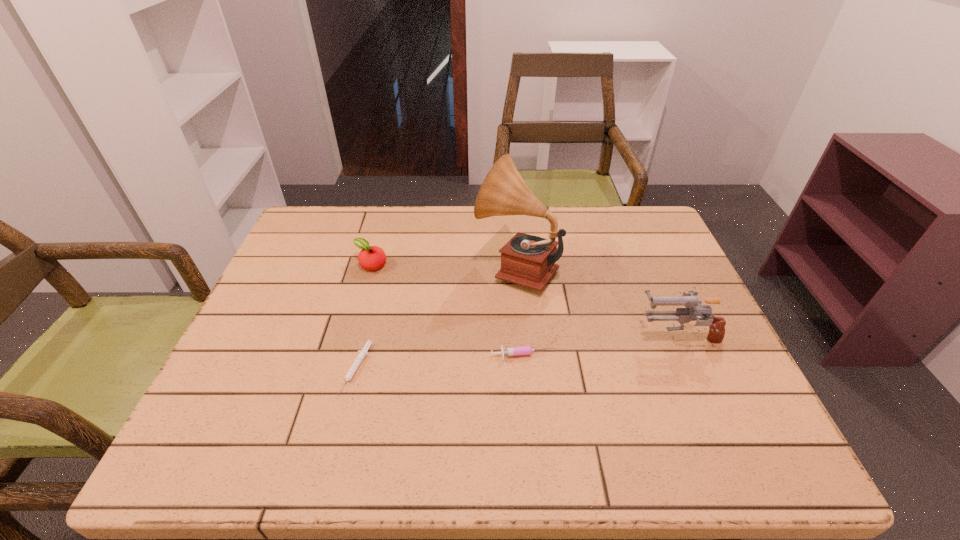
Identify the location of phonograph record. The width and height of the screenshot is (960, 540). (527, 260).

Find the location of a particular element. This screenshot has width=960, height=540. the rightmost object is located at coordinates (694, 308).

Where is `gun`? The image size is (960, 540). gun is located at coordinates (694, 308).

Where is `the third shortest object`? The width and height of the screenshot is (960, 540). the third shortest object is located at coordinates (370, 258).

Identify the location of the right syringe. (520, 350).

This screenshot has width=960, height=540. Identify the location of the fourth tallest object. (520, 350).

The image size is (960, 540). I want to click on the left syringe, so click(362, 353).

You are a GUI agent. You are given a task and a screenshot of the screen. Output one action in this format:
    pyautogui.click(x=<x>, y=<y>)
    Task: Click on the shorter syringe
    The height and width of the screenshot is (540, 960).
    Given the screenshot: What is the action you would take?
    coord(362,353)

I want to click on vacant point located 0.400m on the horn of the phonograph record, so click(332, 267).

Identify the location of free point located on the horn of the phonograph record. (436, 267).